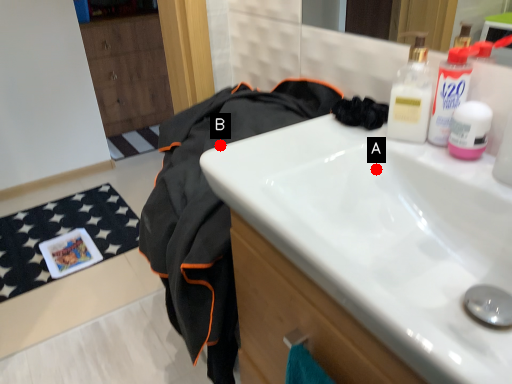
Question: Two points are circled on the image, labeled by A and B beside each circle. Which of the following is the farthest from the observer?

Choices:
 (A) A is further
 (B) B is further

Answer: (B)